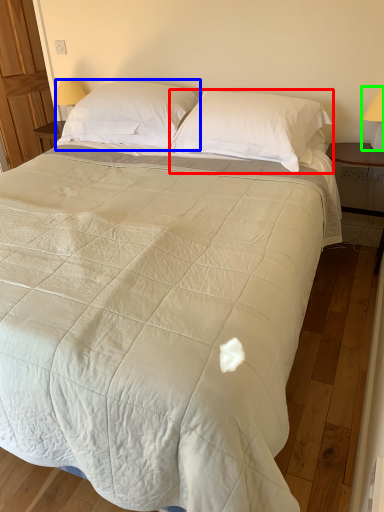
Question: Which object is the closest to the pillow (highlighted by a red box)? Choose among these: pillow (highlighted by a blue box) or table lamp (highlighted by a green box).

Choices:
 (A) pillow
 (B) table lamp

Answer: (A)